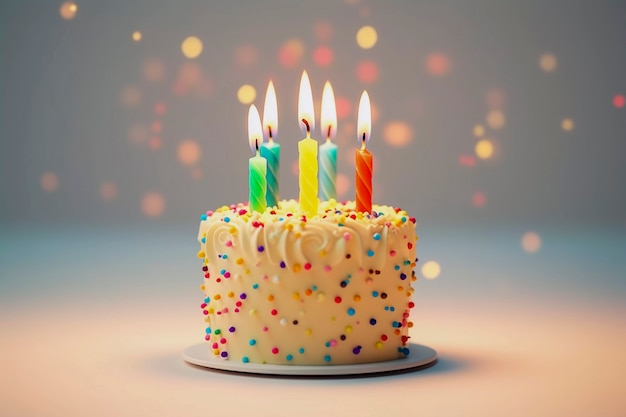
Locate an element on the screen. The image size is (626, 417). candles is located at coordinates (250, 173), (272, 162), (305, 162), (329, 163), (362, 171).